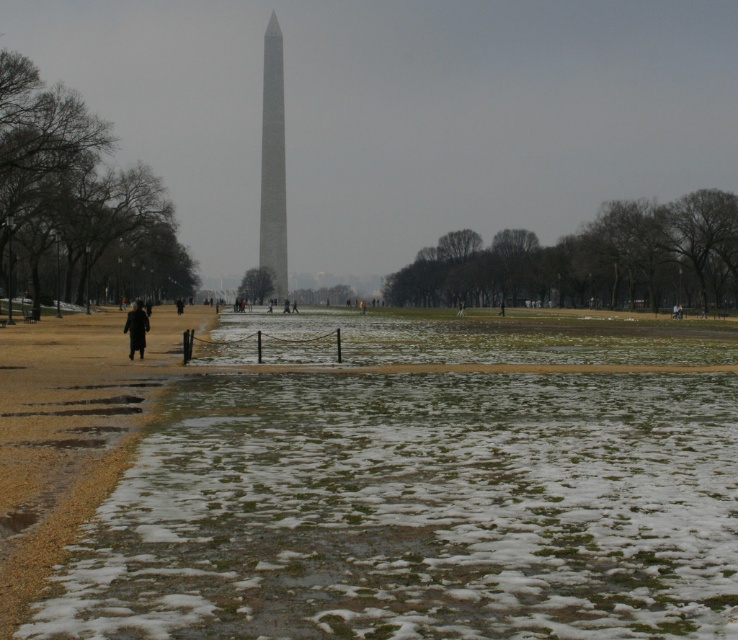
Does point (269, 166) lie in front of point (137, 328)?

No, it is not.

Who is more distant from viewer, (263,67) or (142,356)?

Point (263,67)

Where is `smooth gray obelisk at center`? smooth gray obelisk at center is located at coordinates (272, 163).